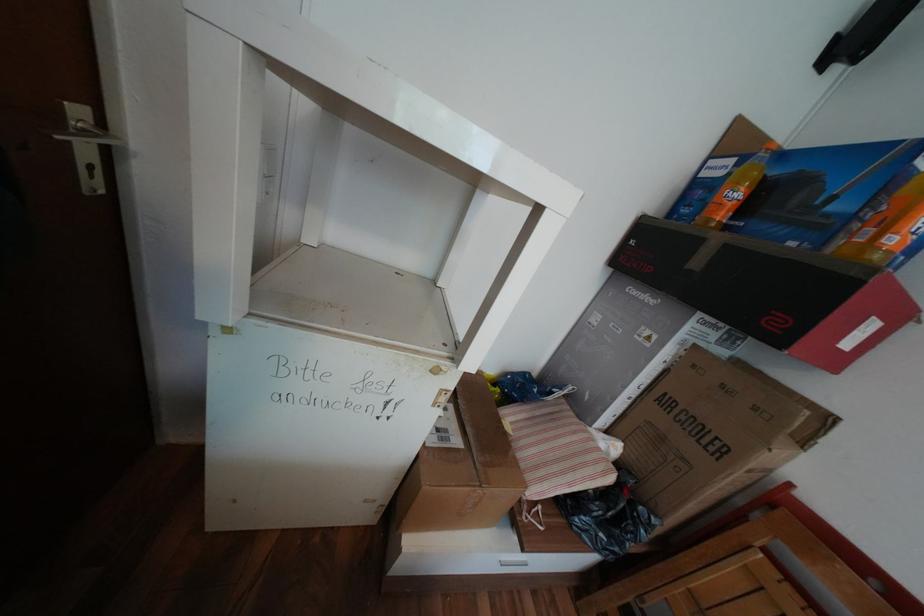
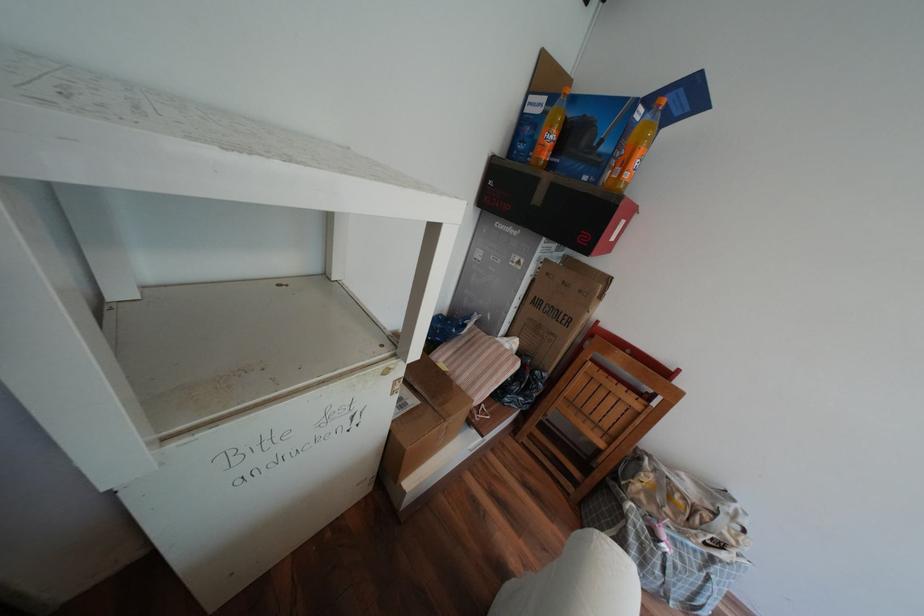
In the second image, find the point that corresponds to (x=764, y=408) in the first image.

(590, 291)